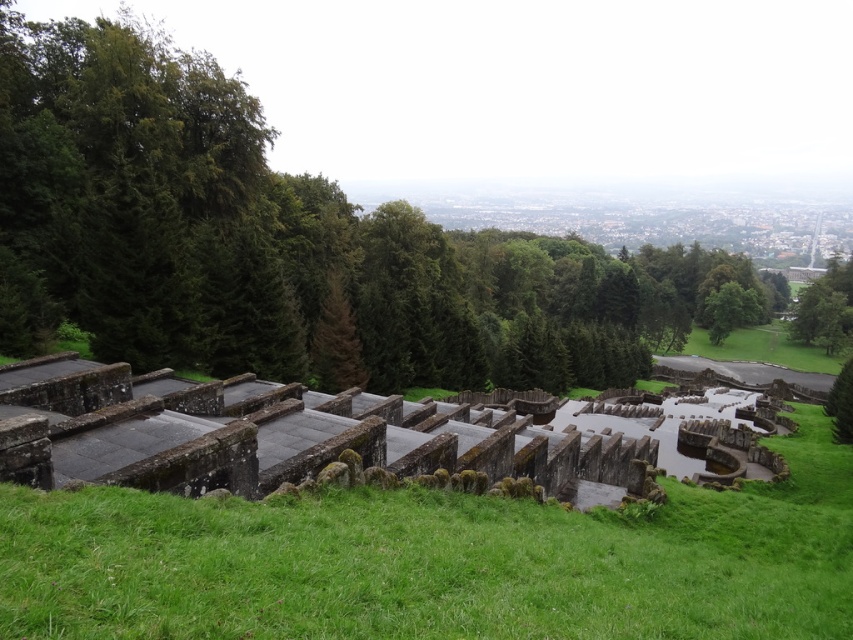
You are standing at the camera position overlooking the stone terraces and water feature in the scene. If you walk directly towards the point labeled as point (x=746, y=310), how far will you have to walk to reach it?

You will have to walk 722.00 feet to reach the point labeled as point (x=746, y=310) from the camera position.

You are standing at the top of the stone terraces and want to take a photo of both the point at coordinates (x=720, y=291) and the point at coordinates (x=844, y=404). Which point will appear closer to the camera in your photo?

The point at coordinates (x=720, y=291) will appear closer to the camera in your photo because it is further to the camera than the point at coordinates (x=844, y=404).

You are standing at the top of the stone terraces and see the green leafy tree at upper center and the green leafy tree at lower right. Which tree is located to the right when looking towards the lower right tree?

The green leafy tree at upper center is positioned on the right side of the green leafy tree at lower right, so when looking towards the lower right tree, the upper center tree is to its right.